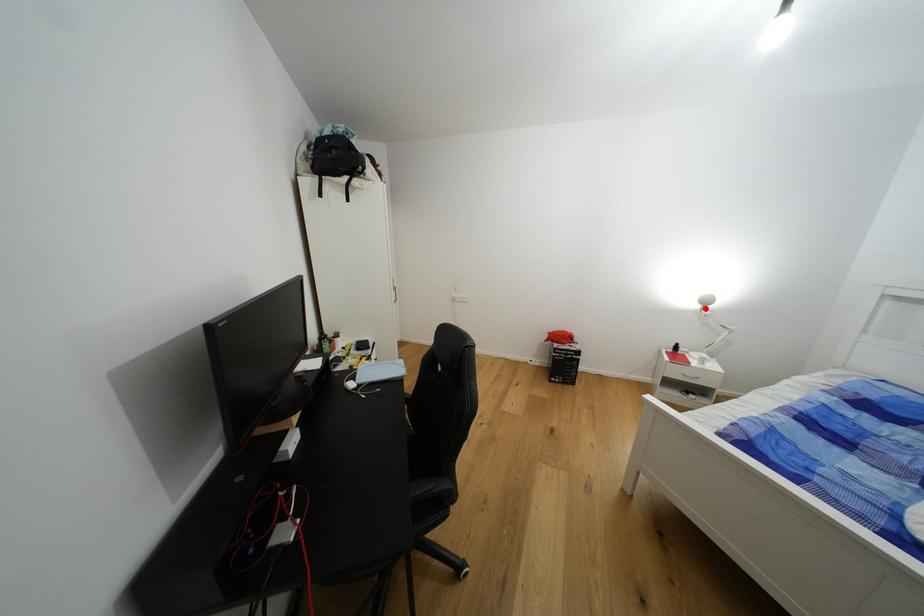
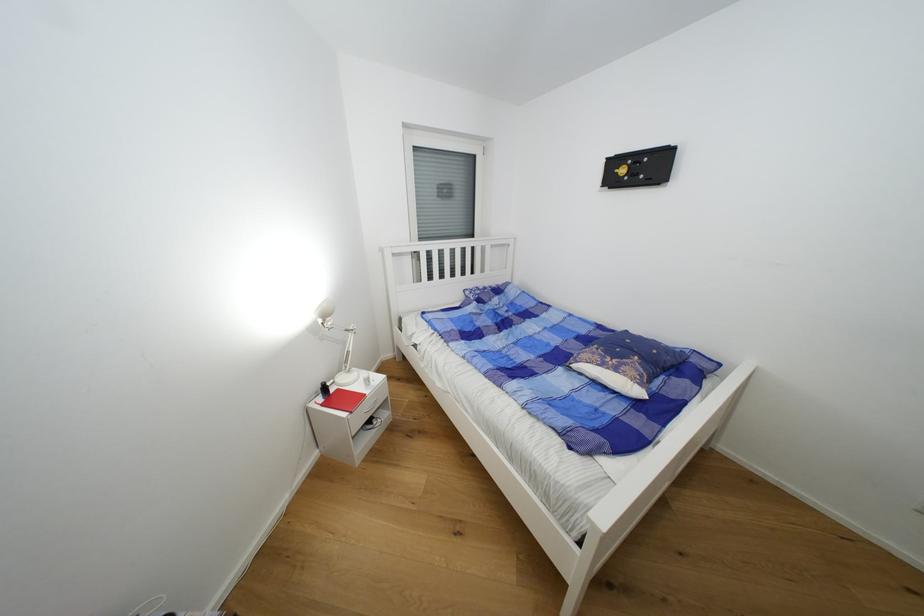
Question: I am providing you with two images of the same scene from different viewpoints. A red point is marked on the first image. At the location where the point appears in image 1, is it still visible in image 2?

Choices:
 (A) Yes
 (B) No

Answer: (A)